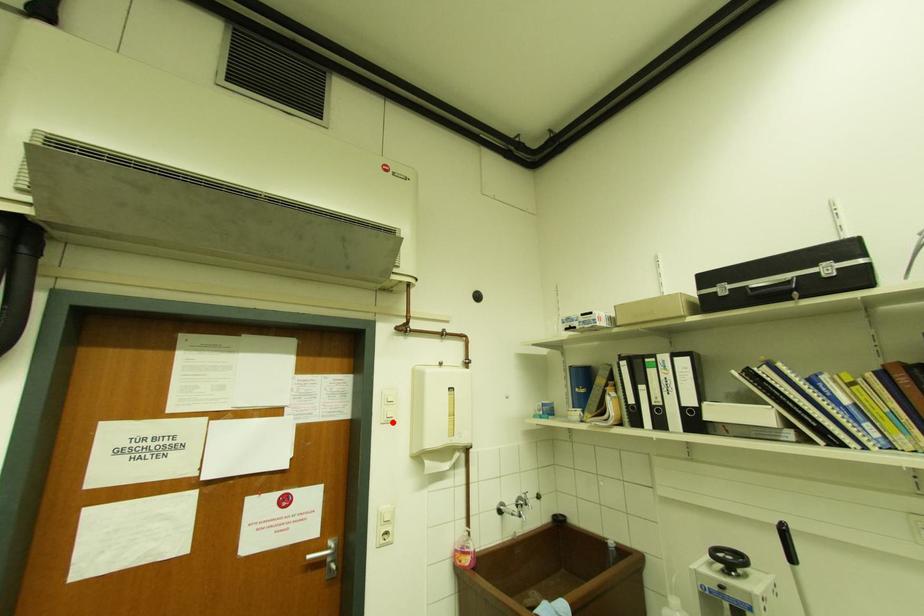
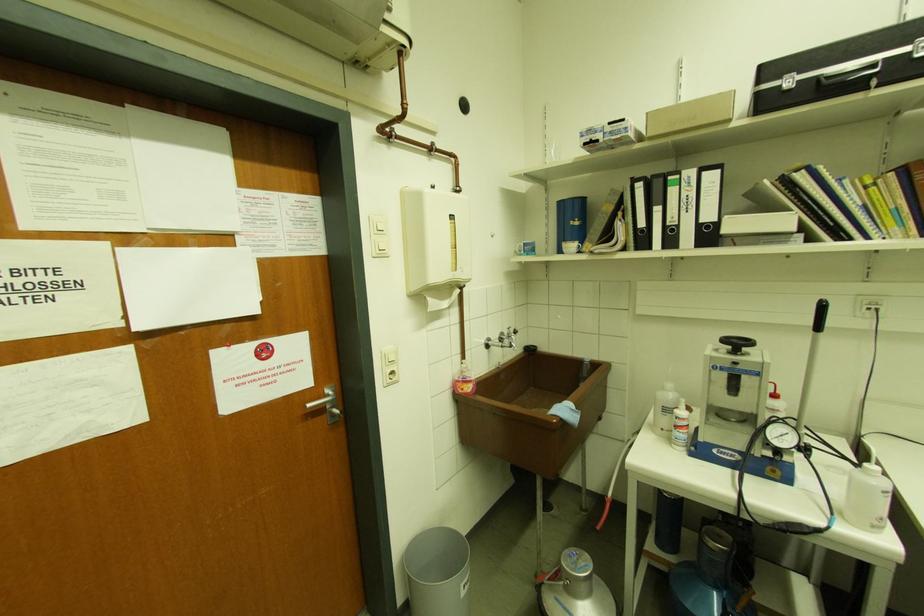
Question: I am providing you with two images of the same scene from different viewpoints. A red point is marked on the first image. Is the red point's position out of view in image 2?

Choices:
 (A) Yes
 (B) No

Answer: (B)